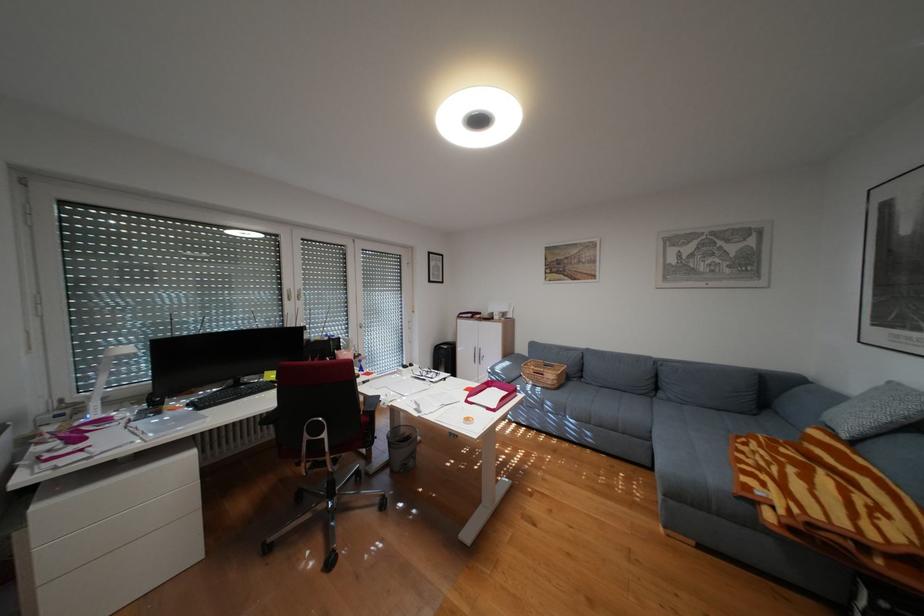
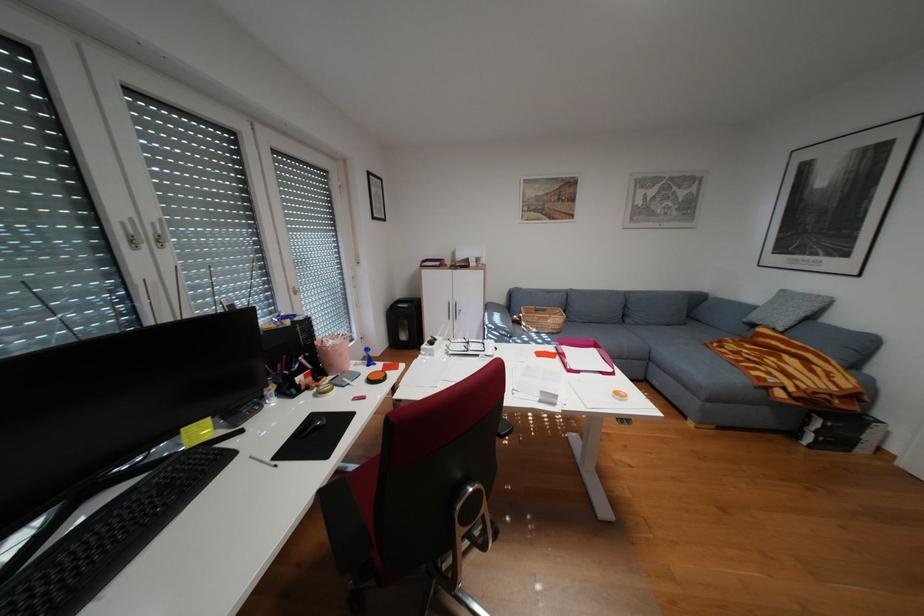
In the second image, find the point that corresponds to pixel 775 484 in the first image.

(782, 373)